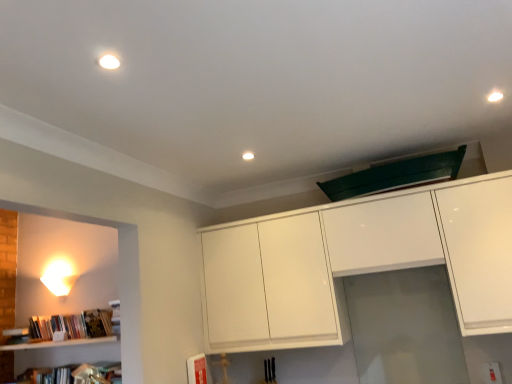
Question: From a real-world perspective, does white glossy cabinet at upper center sit lower than transparent glass door at center?

Choices:
 (A) no
 (B) yes

Answer: (A)

Question: Can you confirm if white glossy cabinet at upper center is taller than transparent glass door at center?

Choices:
 (A) yes
 (B) no

Answer: (A)

Question: Is transparent glass door at center at the back of white glossy cabinet at upper center?

Choices:
 (A) no
 (B) yes

Answer: (B)

Question: Can you confirm if white glossy cabinet at upper center is shorter than transparent glass door at center?

Choices:
 (A) no
 (B) yes

Answer: (A)

Question: Considering the relative positions of white glossy cabinet at upper center and transparent glass door at center in the image provided, is white glossy cabinet at upper center to the left of transparent glass door at center from the viewer's perspective?

Choices:
 (A) no
 (B) yes

Answer: (B)

Question: Does white glossy cabinet at upper center turn towards transparent glass door at center?

Choices:
 (A) no
 (B) yes

Answer: (A)

Question: Considering the relative sizes of white glossy cabinet at upper center and white glossy wall sconce at left in the image provided, is white glossy cabinet at upper center taller than white glossy wall sconce at left?

Choices:
 (A) no
 (B) yes

Answer: (B)

Question: Is white glossy cabinet at upper center at the left side of white glossy wall sconce at left?

Choices:
 (A) no
 (B) yes

Answer: (A)

Question: Is white glossy cabinet at upper center to the right of white glossy wall sconce at left from the viewer's perspective?

Choices:
 (A) yes
 (B) no

Answer: (A)

Question: Is white glossy cabinet at upper center oriented away from white glossy wall sconce at left?

Choices:
 (A) yes
 (B) no

Answer: (B)

Question: Is white glossy cabinet at upper center far away from white glossy wall sconce at left?

Choices:
 (A) no
 (B) yes

Answer: (B)

Question: Is white glossy cabinet at upper center in contact with white glossy wall sconce at left?

Choices:
 (A) yes
 (B) no

Answer: (B)

Question: Are white glossy wall sconce at left and transparent glass door at center making contact?

Choices:
 (A) yes
 (B) no

Answer: (B)